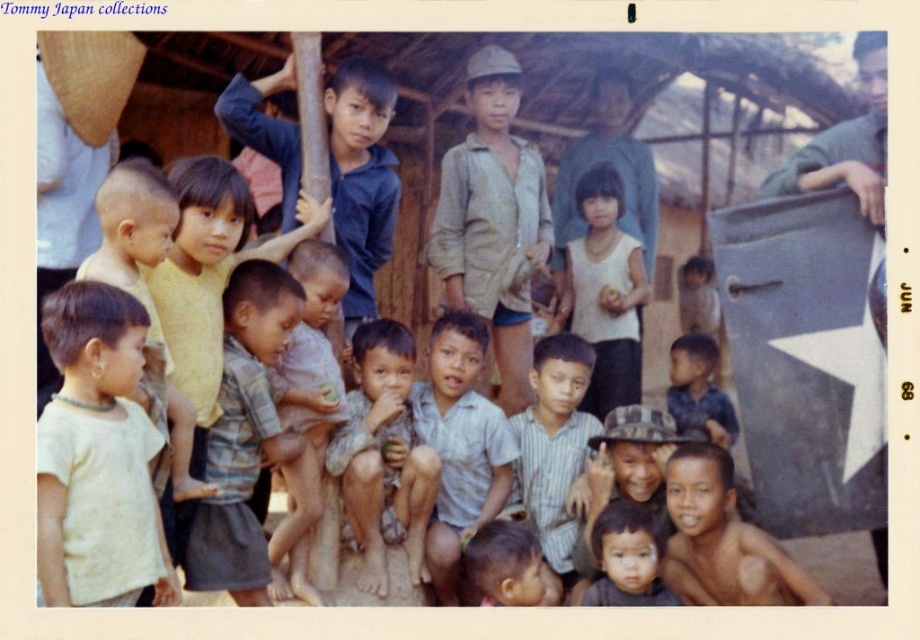
You are a photographer trying to capture a group shot of the children. You want to ensure that both the brown textured shirt at center and the white matte tank top at center are in focus. Given that your camera has a depth of field that can cover up to 5 meters, will both subjects be in focus?

The distance between the brown textured shirt at center and the white matte tank top at center is 4.78 meters, which is within the camera lens depth of field of 5 meters. Therefore, both subjects will be in focus.

Consider the image. You are a photographer trying to capture the children in the scene. You notice a point at coordinates (383, 454). What object is located at this point?

The point at coordinates (383, 454) marks the brown textured shirt at center.

You are a photographer trying to capture a photo of the children and the rustic wooden structure. You notice two points marked in the image. Which point is closer to the camera, point (x=359, y=474) or point (x=621, y=248)?

Point (x=359, y=474) is in front of point (x=621, y=248), so it is closer to the camera.